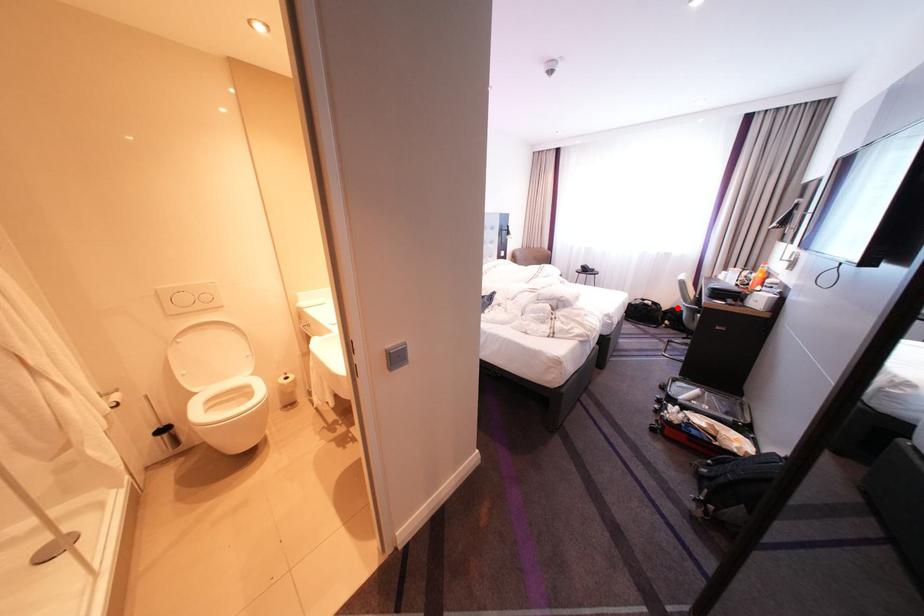
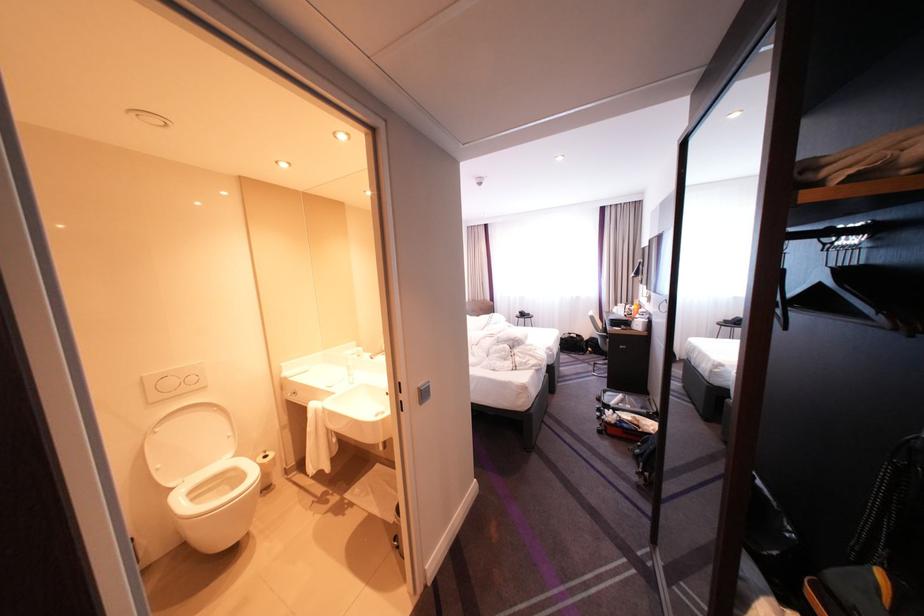
In the second image, find the point that corresponds to the highlighted location in the first image.

(599, 338)